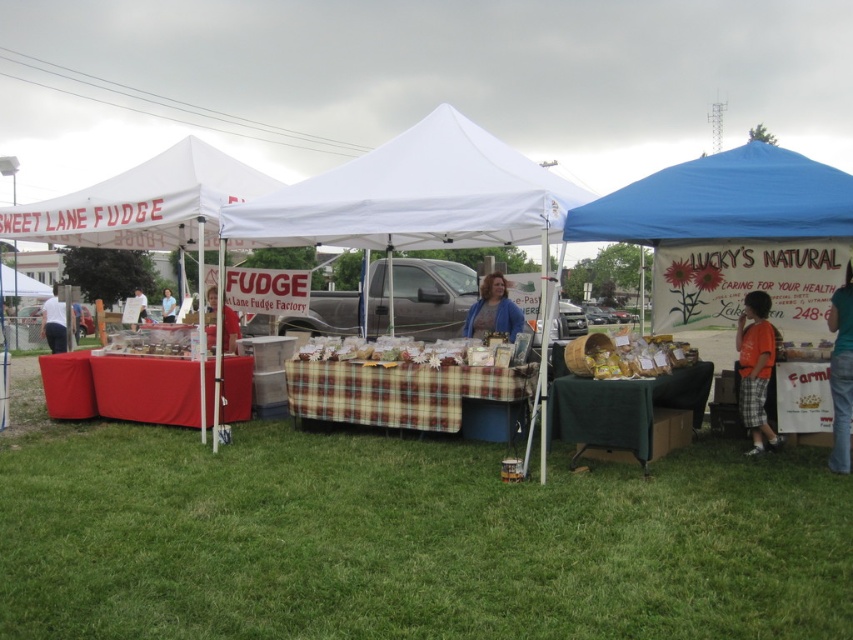
Can you confirm if green grass at lower center is thinner than blue fabric canopy at upper right?

Incorrect, green grass at lower center's width is not less than blue fabric canopy at upper right's.

Is green grass at lower center further to the viewer compared to blue fabric canopy at upper right?

No, green grass at lower center is closer to the viewer.

Which is in front, point (94, 502) or point (808, 196)?

Point (94, 502) is in front.

In order to click on green grass at lower center in this screenshot , I will do `click(410, 540)`.

Is orange cotton shirt at right bigger than matte red shirt at center?

Actually, orange cotton shirt at right might be smaller than matte red shirt at center.

Is orange cotton shirt at right below matte red shirt at center?

Indeed, orange cotton shirt at right is positioned under matte red shirt at center.

Does point (759, 304) come farther from viewer compared to point (138, 317)?

No, it is not.

Find the location of `orange cotton shirt at right`. orange cotton shirt at right is located at coordinates (755, 368).

Is the position of blue fabric tent at right more distant than that of matte blue sweater at center?

No, blue fabric tent at right is closer to the viewer.

Is blue fabric tent at right thinner than matte blue sweater at center?

No.

At what (x,y) coordinates should I click in order to perform the action: click on blue fabric tent at right. Please return your answer as a coordinate pair (x, y). This screenshot has width=853, height=640. Looking at the image, I should click on (722, 202).

Where is `blue fabric tent at right`? This screenshot has width=853, height=640. blue fabric tent at right is located at coordinates (722, 202).